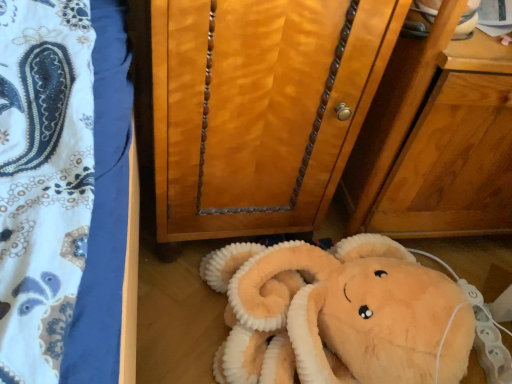
What do you see at coordinates (254, 107) in the screenshot? The width and height of the screenshot is (512, 384). I see `wooden cabinet at center` at bounding box center [254, 107].

Measure the distance between point (222,217) and camera.

They are 32.60 inches apart.

Where is `wooden cabinet at center`? wooden cabinet at center is located at coordinates (254, 107).

What do you see at coordinates (330, 312) in the screenshot? I see `soft plush toy at lower center` at bounding box center [330, 312].

Find the location of `soft plush toy at lower center`. soft plush toy at lower center is located at coordinates (330, 312).

Locate an element on the screen. wooden cabinet at center is located at coordinates (254, 107).

Between wooden cabinet at center and soft plush toy at lower center, which one appears on the right side from the viewer's perspective?

From the viewer's perspective, soft plush toy at lower center appears more on the right side.

Is wooden cabinet at center further to camera compared to soft plush toy at lower center?

No, the depth of wooden cabinet at center is less than that of soft plush toy at lower center.

Considering the points (271, 85) and (459, 365), which point is behind, point (271, 85) or point (459, 365)?

The point (459, 365) is behind.

From the image's perspective, which is below, wooden cabinet at center or soft plush toy at lower center?

soft plush toy at lower center appears lower in the image.

From a real-world perspective, who is located lower, wooden cabinet at center or soft plush toy at lower center?

soft plush toy at lower center is physically lower.

Considering the relative sizes of wooden cabinet at center and soft plush toy at lower center in the image provided, is wooden cabinet at center thinner than soft plush toy at lower center?

Correct, the width of wooden cabinet at center is less than that of soft plush toy at lower center.

Considering the relative sizes of wooden cabinet at center and soft plush toy at lower center in the image provided, is wooden cabinet at center taller than soft plush toy at lower center?

Yes, wooden cabinet at center is taller than soft plush toy at lower center.

Does wooden cabinet at center have a smaller size compared to soft plush toy at lower center?

No, wooden cabinet at center is not smaller than soft plush toy at lower center.

From the picture: Would you say wooden cabinet at center is inside or outside soft plush toy at lower center?

wooden cabinet at center is not inside soft plush toy at lower center, it's outside.

Is wooden cabinet at center beside soft plush toy at lower center?

They are not placed beside each other.

Does wooden cabinet at center turn towards soft plush toy at lower center?

Yes.

What's the angular difference between wooden cabinet at center and soft plush toy at lower center's facing directions?

100 degrees separate the facing orientations of wooden cabinet at center and soft plush toy at lower center.

This screenshot has height=384, width=512. In the image, there is a wooden cabinet at center. Find the location of `toy below it (from a real-world perspective)`. toy below it (from a real-world perspective) is located at coordinates (330, 312).

Based on their positions, is soft plush toy at lower center located to the left or right of wooden cabinet at center?

In the image, soft plush toy at lower center appears on the right side of wooden cabinet at center.

Is the depth of soft plush toy at lower center less than that of wooden cabinet at center?

No, it is behind wooden cabinet at center.

Which point is more forward, (372, 281) or (170, 164)?

The point (170, 164) is closer.

From the image's perspective, which one is positioned higher, soft plush toy at lower center or wooden cabinet at center?

From the image's view, wooden cabinet at center is above.

From a real-world perspective, who is located higher, soft plush toy at lower center or wooden cabinet at center?

From a 3D spatial view, wooden cabinet at center is above.

Considering the sizes of objects soft plush toy at lower center and wooden cabinet at center in the image provided, who is wider, soft plush toy at lower center or wooden cabinet at center?

soft plush toy at lower center is wider.

In terms of height, does soft plush toy at lower center look taller or shorter compared to wooden cabinet at center?

Considering their sizes, soft plush toy at lower center has less height than wooden cabinet at center.

Does soft plush toy at lower center have a larger size compared to wooden cabinet at center?

Incorrect, soft plush toy at lower center is not larger than wooden cabinet at center.

Which is correct: soft plush toy at lower center is inside wooden cabinet at center, or outside of it?

soft plush toy at lower center is not inside wooden cabinet at center, it's outside.

Is soft plush toy at lower center positioned far away from wooden cabinet at center?

No, soft plush toy at lower center is not far away from wooden cabinet at center.

Is soft plush toy at lower center turned away from wooden cabinet at center?

No, soft plush toy at lower center is not facing the opposite direction of wooden cabinet at center.

What's the angular difference between soft plush toy at lower center and wooden cabinet at center's facing directions?

The angular difference between soft plush toy at lower center and wooden cabinet at center is 100 degrees.

This screenshot has height=384, width=512. Find the location of `toy behind the wooden cabinet at center`. toy behind the wooden cabinet at center is located at coordinates (330, 312).

Where is `furniture on the left side of soft plush toy at lower center`? furniture on the left side of soft plush toy at lower center is located at coordinates (254, 107).

Locate an element on the screen. toy behind the wooden cabinet at center is located at coordinates (330, 312).